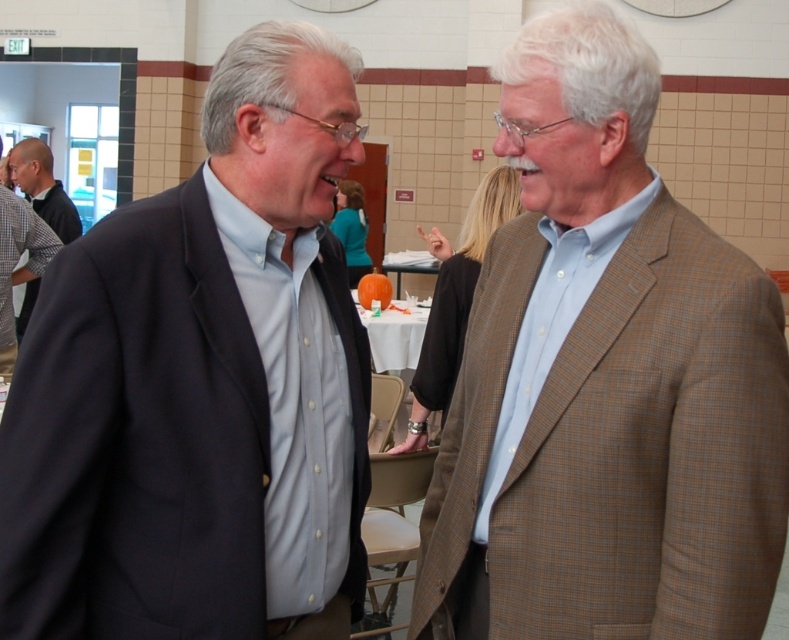
You are standing at the entrance of the room and want to approach the matte black suit at left. Based on its coordinates, which direction should you move from your current position to reach it?

The matte black suit at left is located at coordinates point (200, 385), so you should move towards the lower right direction from the entrance to reach it.

You are an event planner arranging seating for a dinner. You need to place a name tag on the table in front of each guest. The guests are wearing the matte black suit at left and the light brown checkered blazer at center. According to their positions in the image, which guest should have their name tag placed higher on the table?

The name tag for the matte black suit at left should be placed higher on the table because the matte black suit at left is positioned above the light brown checkered blazer at center in the image.